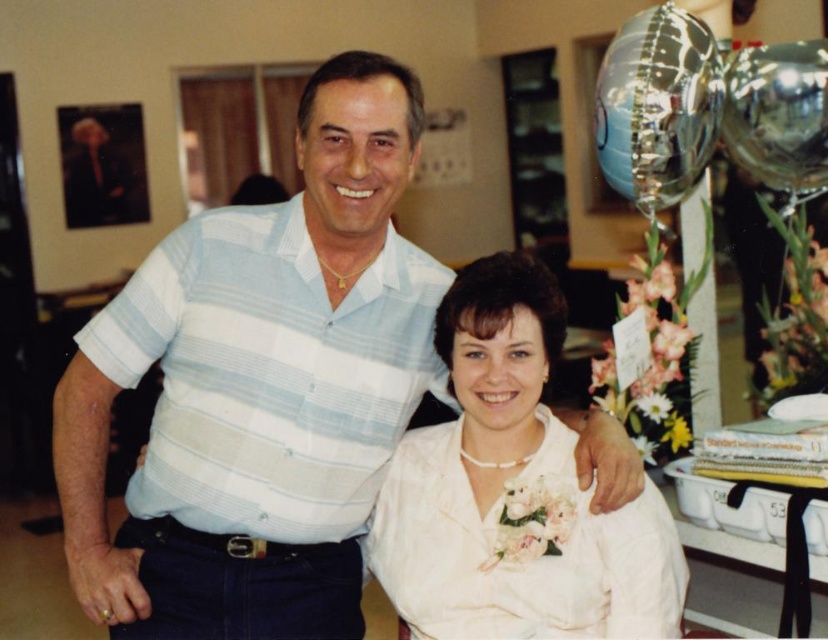
Between light blue striped shirt at center and white satin blouse at center, which one appears on the right side from the viewer's perspective?

white satin blouse at center

Does light blue striped shirt at center lie behind white satin blouse at center?

Yes, it is behind white satin blouse at center.

Does point (368, 230) come in front of point (561, 563)?

No, it is behind (561, 563).

What are the coordinates of `light blue striped shirt at center` in the screenshot? It's located at (260, 387).